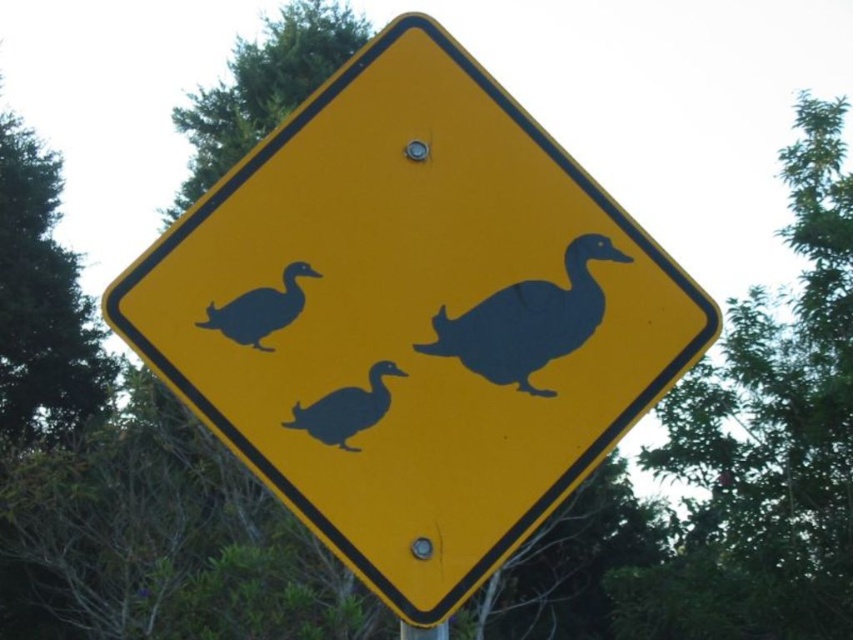
Question: Which point appears closest to the camera in this image?

Choices:
 (A) (379, 508)
 (B) (393, 371)

Answer: (A)

Question: Can you confirm if matte black duck at center is smaller than black matte duck at upper left?

Choices:
 (A) yes
 (B) no

Answer: (B)

Question: Is black matte duck at center below metallic silver pole at lower center?

Choices:
 (A) yes
 (B) no

Answer: (B)

Question: Considering the real-world distances, which object is closest to the black matte duck at upper left?

Choices:
 (A) matte black duck at center
 (B) black matte duck at center

Answer: (B)

Question: Which point is farther from the camera taking this photo?

Choices:
 (A) (469, 490)
 (B) (408, 625)
 (C) (341, 400)
 (D) (287, 304)

Answer: (D)

Question: Does matte black duck at center lie in front of black matte duck at center?

Choices:
 (A) no
 (B) yes

Answer: (A)